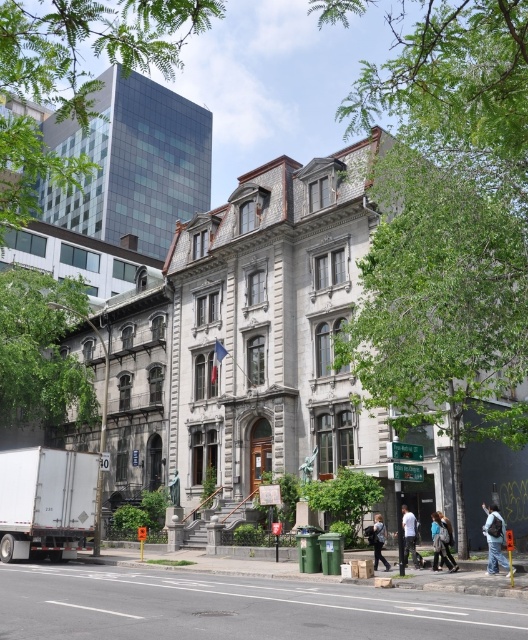
Is white matte truck at left closer to the viewer compared to bronze statue at center?

Yes, it is in front of bronze statue at center.

Does white matte truck at left have a greater width compared to bronze statue at center?

Yes, white matte truck at left is wider than bronze statue at center.

The height and width of the screenshot is (640, 528). I want to click on white matte truck at left, so click(45, 502).

Does white matte truck at left appear on the left side of light blue jeans at center?

Indeed, white matte truck at left is positioned on the left side of light blue jeans at center.

Is white matte truck at left to the right of light blue jeans at center from the viewer's perspective?

In fact, white matte truck at left is to the left of light blue jeans at center.

Is point (51, 528) closer to camera compared to point (403, 508)?

No.

Identify the location of white matte truck at left. (45, 502).

Is light blue jeans at center further to camera compared to light brown leather jacket at lower center?

No, it is in front of light brown leather jacket at lower center.

Who is lower down, light blue jeans at center or light brown leather jacket at lower center?

light brown leather jacket at lower center

Which is in front, point (409, 538) or point (373, 518)?

Point (409, 538)

Where is `light blue jeans at center`? Image resolution: width=528 pixels, height=640 pixels. light blue jeans at center is located at coordinates (410, 536).